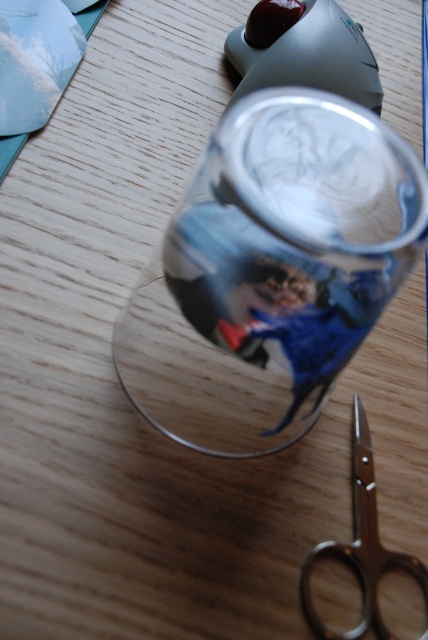
Which is more to the left, transparent glass cup at center or polished silver scissors at lower right?

transparent glass cup at center

Consider the image. Does transparent glass cup at center appear under polished silver scissors at lower right?

No, transparent glass cup at center is not below polished silver scissors at lower right.

Which is behind, point (391, 193) or point (315, 630)?

Point (315, 630)

Find the location of `transparent glass cup at center`. transparent glass cup at center is located at coordinates (270, 272).